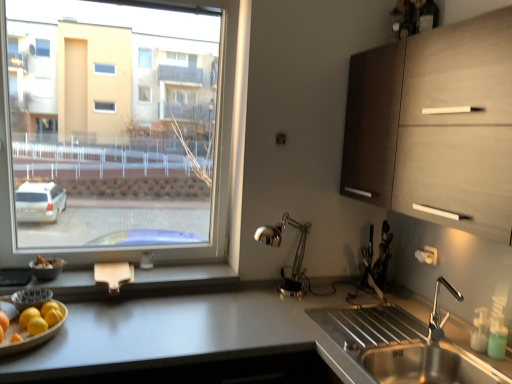
Locate an element on the screen. The height and width of the screenshot is (384, 512). matte black bowl at lower left is located at coordinates (46, 271).

This screenshot has height=384, width=512. Find the location of `white glossy countertop at lower left`. white glossy countertop at lower left is located at coordinates (192, 341).

The width and height of the screenshot is (512, 384). What are the coordinates of `polished metal desk lamp at center` in the screenshot? It's located at (294, 257).

The height and width of the screenshot is (384, 512). What do you see at coordinates (435, 125) in the screenshot?
I see `matte wood cabinet at upper right` at bounding box center [435, 125].

At what (x,y) coordinates should I click in order to perform the action: click on wooden at lower left. Please return your answer as a coordinate pair (x, y). This screenshot has height=384, width=512. Looking at the image, I should click on (179, 278).

This screenshot has width=512, height=384. I want to click on window that appears on the right of wooden at lower left, so click(119, 130).

Looking at this image, considering the relative positions of wooden at lower left and transparent glass window at left in the image provided, is wooden at lower left to the left of transparent glass window at left from the viewer's perspective?

Yes, wooden at lower left is to the left of transparent glass window at left.

Is wooden at lower left wider than transparent glass window at left?

Yes, wooden at lower left is wider than transparent glass window at left.

Is wooden at lower left not within transparent glass window at left?

Yes, wooden at lower left is not within transparent glass window at left.

From a real-world perspective, relative to matte wood cabinet at upper right, is transparent glass window at left vertically above or below?

Clearly, from a real-world perspective, transparent glass window at left is below matte wood cabinet at upper right.

In the scene shown: Which object is positioned more to the left, transparent glass window at left or matte wood cabinet at upper right?

transparent glass window at left is more to the left.

Is transparent glass window at left positioned with its back to matte wood cabinet at upper right?

No, transparent glass window at left's orientation is not away from matte wood cabinet at upper right.

Is transparent glass window at left wider than matte wood cabinet at upper right?

No.

Based on the photo, from a real-world perspective, which object stands above the other?

From a 3D spatial view, green translucent soap dispenser at lower right is above.

Considering the sizes of green translucent soap dispenser at lower right and wooden tray with fruits at lower left in the image, is green translucent soap dispenser at lower right wider or thinner than wooden tray with fruits at lower left?

green translucent soap dispenser at lower right is thinner than wooden tray with fruits at lower left.

From their relative heights in the image, would you say green translucent soap dispenser at lower right is taller or shorter than wooden tray with fruits at lower left?

Considering their sizes, green translucent soap dispenser at lower right has more height than wooden tray with fruits at lower left.

Is green translucent soap dispenser at lower right positioned far away from wooden tray with fruits at lower left?

green translucent soap dispenser at lower right is positioned a significant distance from wooden tray with fruits at lower left.

Based on the photo, is wooden tray with fruits at lower left oriented towards transparent glass window at left?

No.

Looking at this image, is wooden tray with fruits at lower left to the right of transparent glass window at left from the viewer's perspective?

Incorrect, wooden tray with fruits at lower left is not on the right side of transparent glass window at left.

Considering the sizes of objects wooden tray with fruits at lower left and transparent glass window at left in the image provided, who is thinner, wooden tray with fruits at lower left or transparent glass window at left?

transparent glass window at left is thinner.

Which of these two, wooden tray with fruits at lower left or transparent glass window at left, is bigger?

transparent glass window at left.

I want to click on fruit dish that is on the left side of matte wood cabinet at upper right, so click(x=34, y=337).

Looking at this image, is matte wood cabinet at upper right located outside wooden tray with fruits at lower left?

Yes, matte wood cabinet at upper right is outside of wooden tray with fruits at lower left.

From the picture: Based on their positions, is wooden at lower left located to the left or right of matte wood cabinet at upper right?

Clearly, wooden at lower left is on the left of matte wood cabinet at upper right in the image.

From the image's perspective, between wooden at lower left and matte wood cabinet at upper right, who is located below?

From the image's view, wooden at lower left is below.

Considering the sizes of wooden at lower left and matte wood cabinet at upper right in the image, is wooden at lower left bigger or smaller than matte wood cabinet at upper right?

Considering their sizes, wooden at lower left takes up less space than matte wood cabinet at upper right.

Is wooden at lower left positioned behind matte wood cabinet at upper right?

Yes, it is.

Is transparent glass window at left facing towards wooden tray with fruits at lower left?

Yes, transparent glass window at left is oriented towards wooden tray with fruits at lower left.

In terms of width, does transparent glass window at left look wider or thinner when compared to wooden tray with fruits at lower left?

In the image, transparent glass window at left appears to be more narrow than wooden tray with fruits at lower left.

Can you see transparent glass window at left touching wooden tray with fruits at lower left?

transparent glass window at left and wooden tray with fruits at lower left are not in contact.

Where is `window on the right of the wooden at lower left`? window on the right of the wooden at lower left is located at coordinates (119, 130).

What are the coordinates of `window that appears above the matte wood cabinet at upper right (from the image's perspective)` in the screenshot? It's located at (119, 130).

Based on the photo, looking at the image, which one is located closer to matte black bowl at lower left, matte wood cabinet at upper right or white glossy countertop at lower left?

white glossy countertop at lower left is closer to matte black bowl at lower left.

Which object lies further to the anchor point polished metal desk lamp at center, transparent glass window at left or matte wood cabinet at upper right?

Based on the image, transparent glass window at left appears to be further to polished metal desk lamp at center.

Looking at the image, which one is located further to transparent glass window at left, matte black bowl at lower left or polished metal desk lamp at center?

polished metal desk lamp at center is further to transparent glass window at left.

Which object lies nearer to the anchor point green translucent soap dispenser at lower right, matte wood cabinet at upper right or transparent glass window at left?

Based on the image, matte wood cabinet at upper right appears to be nearer to green translucent soap dispenser at lower right.

From the image, which object appears to be farther from polished metal desk lamp at center, green translucent soap dispenser at lower right or matte wood cabinet at upper right?

green translucent soap dispenser at lower right is further to polished metal desk lamp at center.

When comparing their distances from matte black bowl at lower left, does polished metal desk lamp at center or wooden tray with fruits at lower left seem further?

polished metal desk lamp at center is positioned further to the anchor matte black bowl at lower left.

Which object lies nearer to the anchor point white glossy countertop at lower left, stainless steel sink at lower right or wooden at lower left?

stainless steel sink at lower right.

Looking at the image, which one is located closer to matte black bowl at lower left, polished metal desk lamp at center or matte wood cabinet at upper right?

Among the two, polished metal desk lamp at center is located nearer to matte black bowl at lower left.

The image size is (512, 384). Find the location of `silver between white glossy countertop at lower left and matte wood cabinet at upper right from left to right`. silver between white glossy countertop at lower left and matte wood cabinet at upper right from left to right is located at coordinates (294, 257).

Locate an element on the screen. This screenshot has height=384, width=512. window sill between wooden tray with fruits at lower left and green translucent soap dispenser at lower right in the horizontal direction is located at coordinates (179, 278).

Locate an element on the screen. The width and height of the screenshot is (512, 384). countertop between transparent glass window at left and stainless steel sink at lower right is located at coordinates click(192, 341).

Find the location of `window located between matte black bowl at lower left and stainless steel sink at lower right in the left-right direction`. window located between matte black bowl at lower left and stainless steel sink at lower right in the left-right direction is located at coordinates (119, 130).